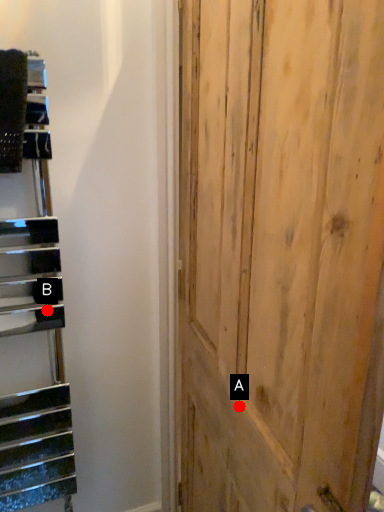
Question: Two points are circled on the image, labeled by A and B beside each circle. Which point is farther from the camera taking this photo?

Choices:
 (A) A is further
 (B) B is further

Answer: (B)